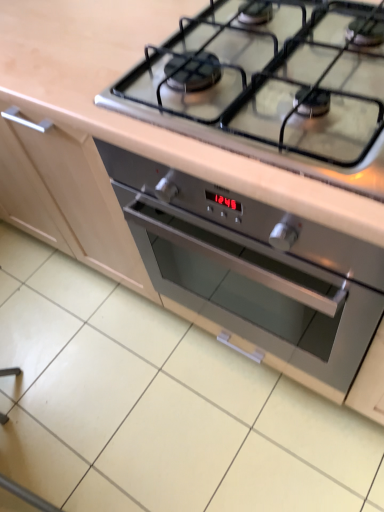
Question: Is stainless steel gas stove at upper center directly adjacent to stainless steel oven at center?

Choices:
 (A) no
 (B) yes

Answer: (A)

Question: Considering the relative sizes of stainless steel gas stove at upper center and stainless steel oven at center in the image provided, is stainless steel gas stove at upper center bigger than stainless steel oven at center?

Choices:
 (A) no
 (B) yes

Answer: (A)

Question: Is stainless steel gas stove at upper center far away from stainless steel oven at center?

Choices:
 (A) no
 (B) yes

Answer: (A)

Question: Is stainless steel gas stove at upper center oriented towards stainless steel oven at center?

Choices:
 (A) yes
 (B) no

Answer: (B)

Question: Is stainless steel gas stove at upper center thinner than stainless steel oven at center?

Choices:
 (A) yes
 (B) no

Answer: (A)

Question: Is stainless steel gas stove at upper center in front of stainless steel oven at center?

Choices:
 (A) no
 (B) yes

Answer: (B)

Question: From a real-world perspective, is stainless steel oven at center over stainless steel gas stove at upper center?

Choices:
 (A) no
 (B) yes

Answer: (A)

Question: Is stainless steel oven at center facing away from stainless steel gas stove at upper center?

Choices:
 (A) no
 (B) yes

Answer: (A)

Question: Is stainless steel oven at center shorter than stainless steel gas stove at upper center?

Choices:
 (A) yes
 (B) no

Answer: (B)

Question: Is stainless steel oven at center oriented towards stainless steel gas stove at upper center?

Choices:
 (A) no
 (B) yes

Answer: (A)

Question: Is stainless steel oven at center to the left of stainless steel gas stove at upper center from the viewer's perspective?

Choices:
 (A) no
 (B) yes

Answer: (A)

Question: Would you consider stainless steel oven at center to be distant from stainless steel gas stove at upper center?

Choices:
 (A) yes
 (B) no

Answer: (B)

Question: From a real-world perspective, is stainless steel oven at center positioned above or below stainless steel gas stove at upper center?

Choices:
 (A) above
 (B) below

Answer: (B)